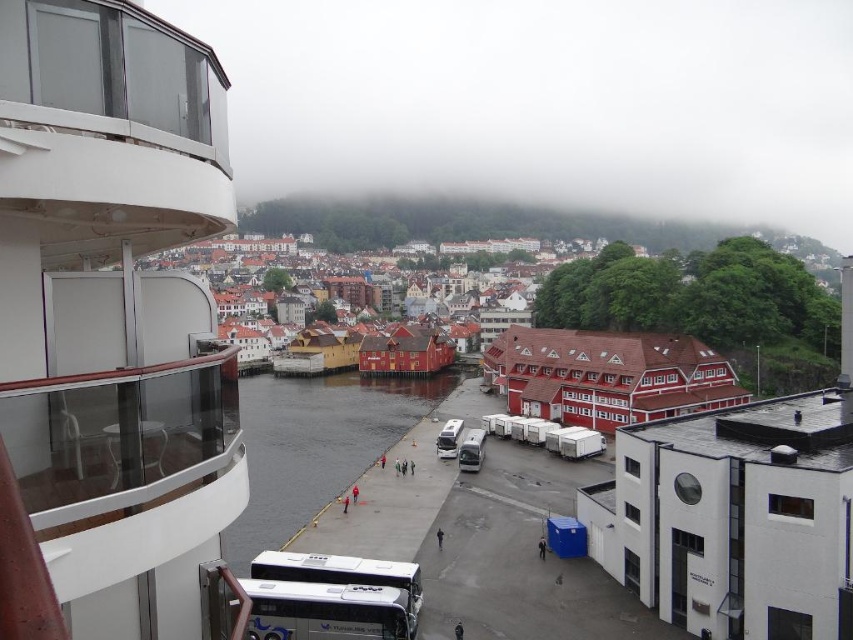
You are a photographer planning to capture the entire scene in one shot. Considering the white glossy cruise ship at left and the dark gray concrete river at center, which object should you position closer to the edge of your camera frame to ensure both are fully visible?

To ensure both the white glossy cruise ship at left and the dark gray concrete river at center are fully visible in your shot, you should position the white glossy cruise ship at left closer to the edge of your camera frame since it has a lesser width compared to the dark gray concrete river at center.

You are a photographer trying to capture both the white glossy cruise ship at left and the silver metallic van at center in a single shot. Based on their positions, which object will appear larger in your photo?

The white glossy cruise ship at left appears larger in the photo because it is positioned closer to the photographer than the silver metallic van at center.